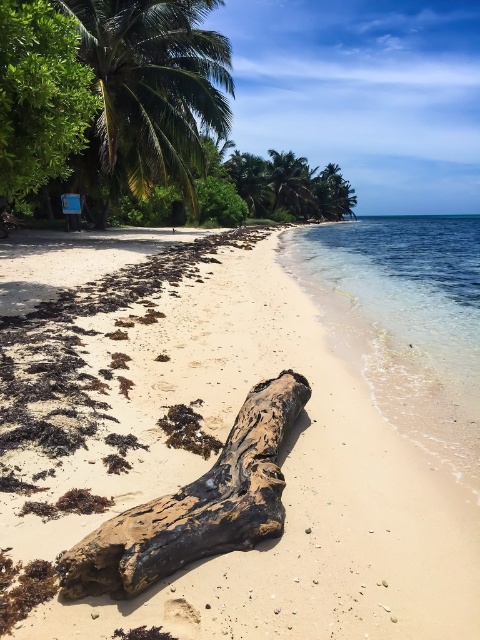
You are a photographer planning to capture the brown sandy beach at center and the green leafy palm tree at upper left in a single shot. Which of these two elements will take up more area in your photo?

The green leafy palm tree at upper left occupies more space than the brown sandy beach at center in the image.